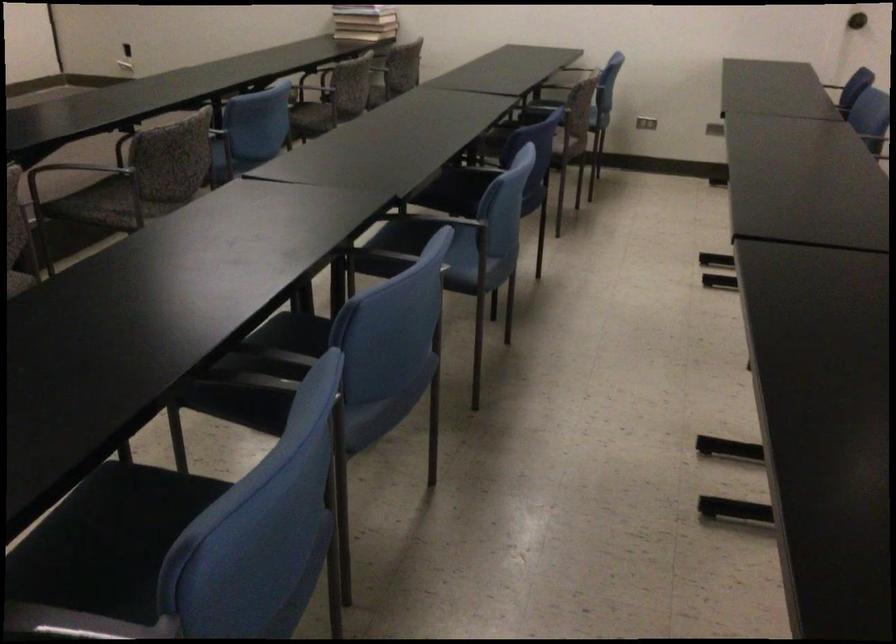
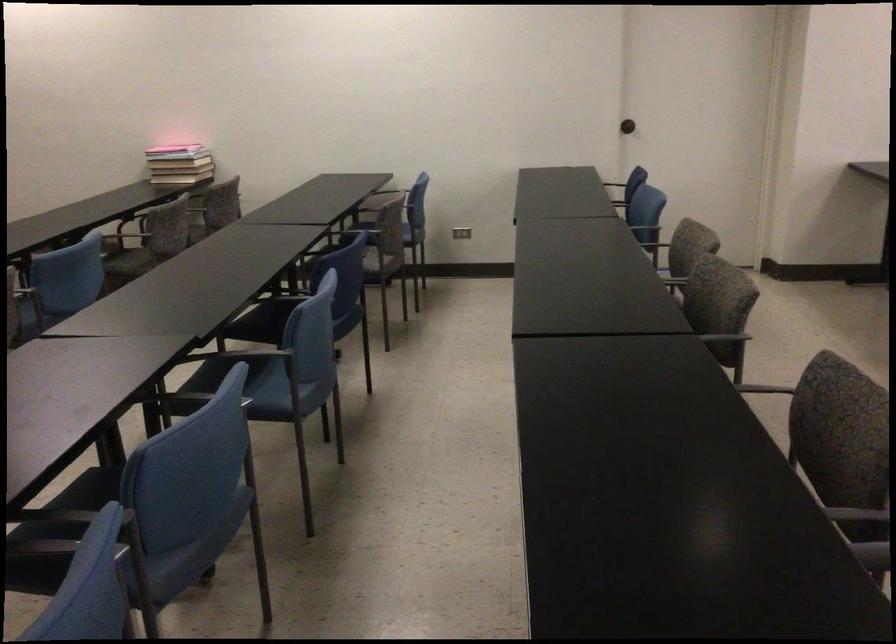
Locate, in the second image, the point that corresponds to point 358,102 in the first image.

(179, 243)